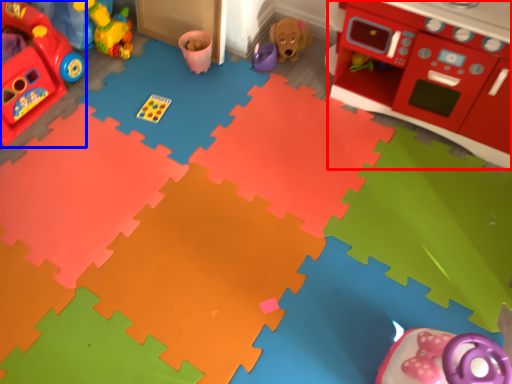
Question: Which point is further to the camera, appliance (highlighted by a red box) or toy (highlighted by a blue box)?

Choices:
 (A) appliance
 (B) toy

Answer: (B)